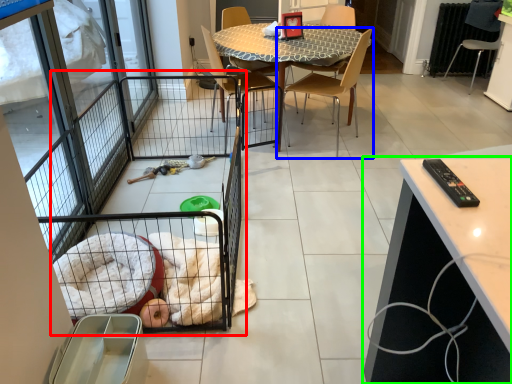
Question: Which object is positioned closest to balcony (highlighted by a red box)? Select from chair (highlighted by a blue box) and cabinetry (highlighted by a green box).

Choices:
 (A) chair
 (B) cabinetry

Answer: (B)